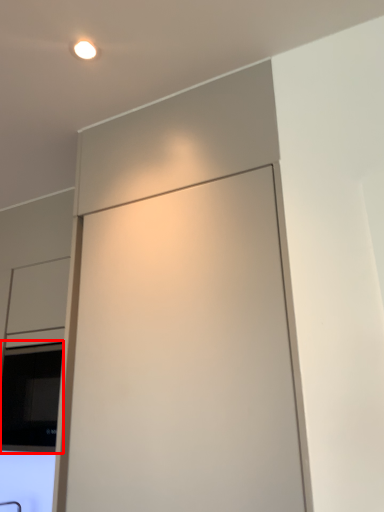
Question: From the image's perspective, what is the correct spatial relationship of window (annotated by the red box) in relation to screen door?

Choices:
 (A) below
 (B) above

Answer: (A)